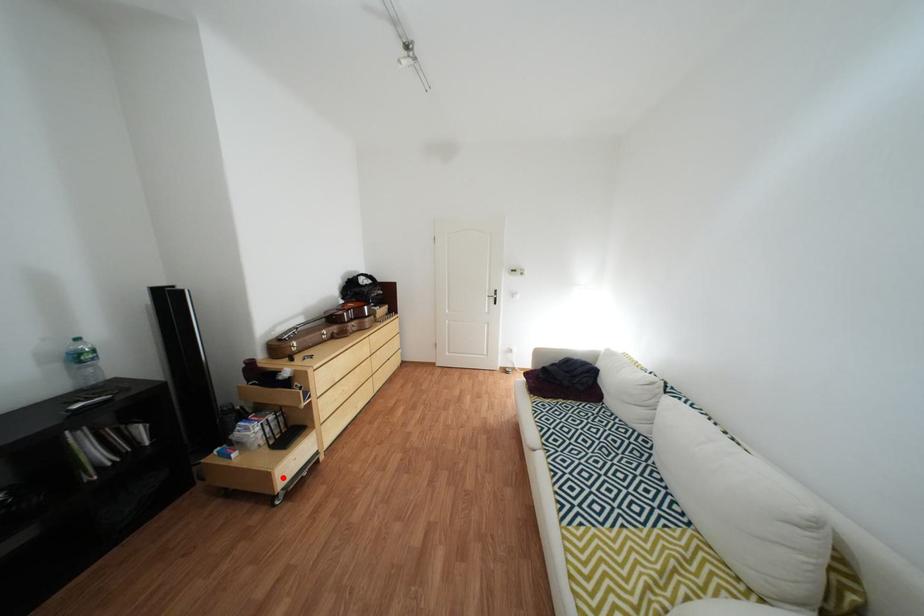
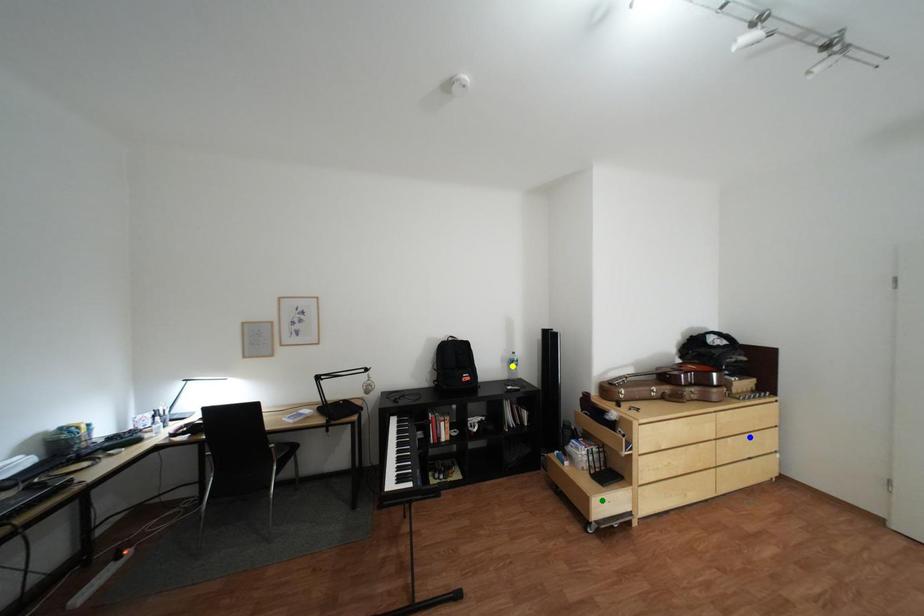
Question: I am providing you with two images of the same scene from different viewpoints. A red point is marked on the first image. You are given multiple points on the second image. Which point in image 2 is actually the same real-world point as the red point in image 1?

Choices:
 (A) green point
 (B) yellow point
 (C) blue point

Answer: (A)